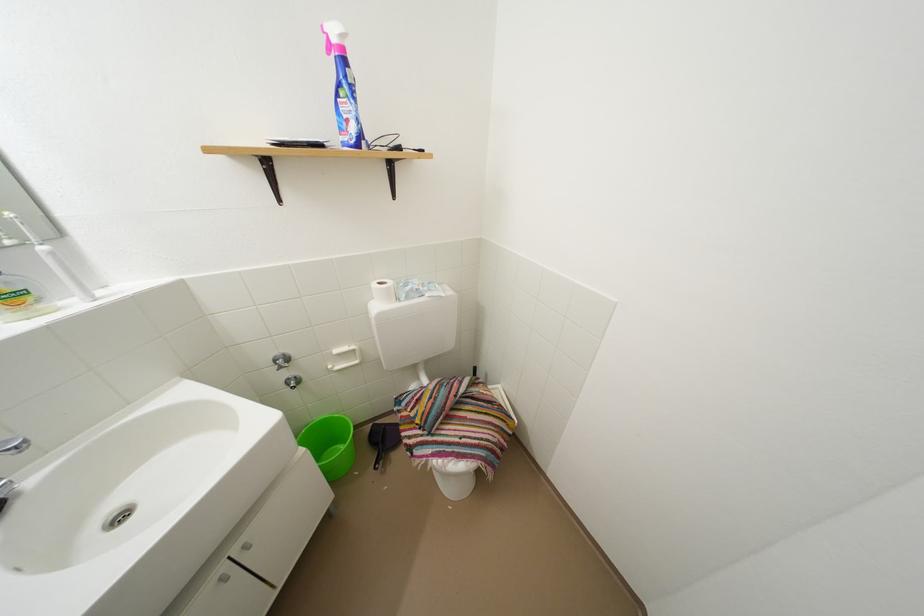
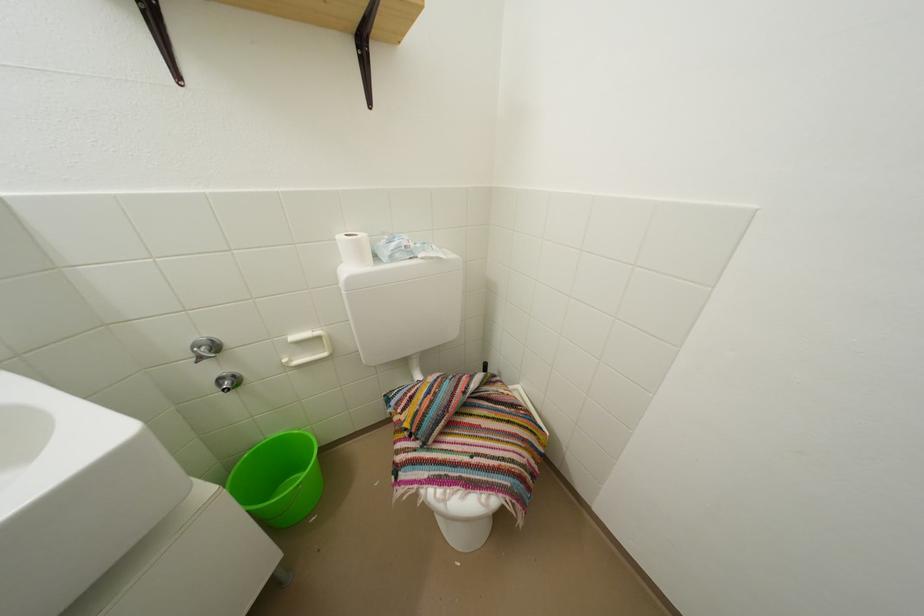
Question: The images are taken continuously from a first-person perspective. In which direction is your viewpoint rotating?

Choices:
 (A) Left
 (B) Right
 (C) Up
 (D) Down

Answer: (C)